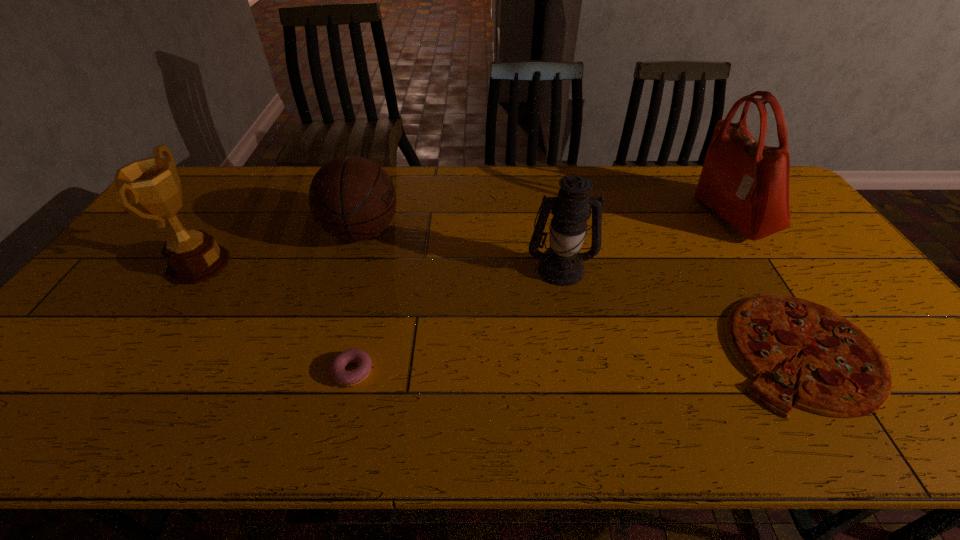
Where is `vacant area that lies between the doughnut and the pizza`? vacant area that lies between the doughnut and the pizza is located at coordinates (577, 361).

Image resolution: width=960 pixels, height=540 pixels. Identify the location of free area in between the pizza and the basketball. click(581, 291).

This screenshot has width=960, height=540. Find the location of `free space between the pizza and the third shortest object`. free space between the pizza and the third shortest object is located at coordinates (581, 291).

Find the location of a particular element. The image size is (960, 540). free area in between the pizza and the basketball is located at coordinates (581, 291).

Locate an element on the screen. free space between the basketball and the leftmost object is located at coordinates (280, 248).

Identify which object is the third nearest to the tallest object. Please provide its 2D coordinates. Your answer should be formatted as a tuple, i.e. [(x, y)], where the tuple contains the x and y coordinates of a point satisfying the conditions above.

[(352, 198)]

Select which object is the fifth closest to the third object from right to left. Please provide its 2D coordinates. Your answer should be formatted as a tuple, i.e. [(x, y)], where the tuple contains the x and y coordinates of a point satisfying the conditions above.

[(152, 184)]

Find the location of a particular element. This screenshot has height=540, width=960. vacant space that satisfies the following two spatial constraints: 1. on the side with brand label of the doughnut; 2. on the left side of the third shortest object is located at coordinates (320, 371).

The image size is (960, 540). Find the location of `free location that satisfies the following two spatial constraints: 1. on the side with brand label of the basketball; 2. on the right side of the oil lamp`. free location that satisfies the following two spatial constraints: 1. on the side with brand label of the basketball; 2. on the right side of the oil lamp is located at coordinates 350,268.

At what (x,y) coordinates should I click in order to perform the action: click on vacant area in the image that satisfies the following two spatial constraints: 1. on the back side of the fourth object from left to right; 2. on the side with brand label of the basketball. Please return your answer as a coordinate pair (x, y). Image resolution: width=960 pixels, height=540 pixels. Looking at the image, I should click on (554, 232).